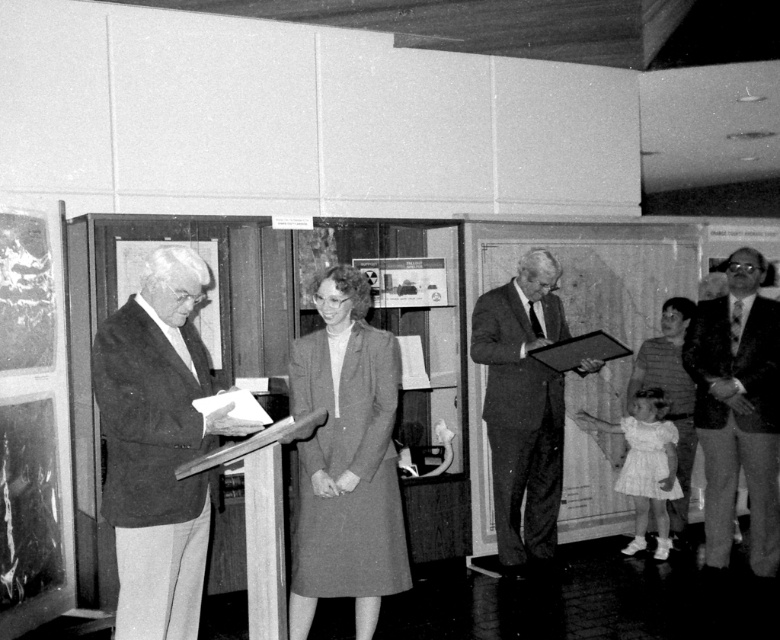
You are organizing a photo shoot and need to ensure that the matte gray coat at center and the suit at center are visible in the frame. Based on their widths, which one is more likely to be fully captured in a standard camera shot without cropping?

The matte gray coat at center has a lesser width compared to the suit at center, so it is more likely to be fully captured in a standard camera shot without cropping.

You are standing at the center of the room and want to approach the point labeled as point (360, 589). Which direction should you move relative to the point labeled point (520, 369)?

Since point (360, 589) is in front of point (520, 369), you should move towards the direction of point (360, 589) which is ahead of point (520, 369).